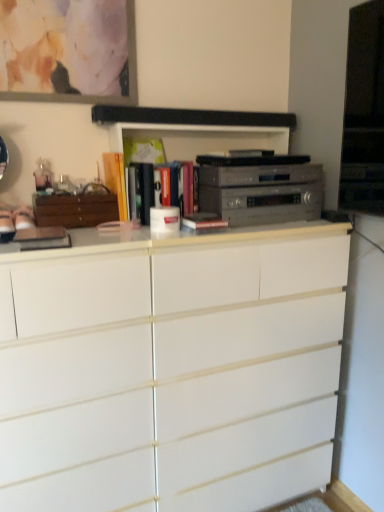
Question: Does matte orange book at center, the fourth book positioned from the right, appear on the left side of white matte chest of drawers at center?

Choices:
 (A) yes
 (B) no

Answer: (A)

Question: Is matte orange book at center, placed as the 1th book when sorted from left to right, bigger than white matte chest of drawers at center?

Choices:
 (A) no
 (B) yes

Answer: (A)

Question: Does matte orange book at center, the fourth book positioned from the right, have a greater width compared to white matte chest of drawers at center?

Choices:
 (A) yes
 (B) no

Answer: (B)

Question: Is matte orange book at center, placed as the 1th book when sorted from left to right, not inside white matte chest of drawers at center?

Choices:
 (A) yes
 (B) no

Answer: (A)

Question: Considering the relative positions of matte orange book at center, the fourth book positioned from the right, and white matte chest of drawers at center in the image provided, is matte orange book at center, the fourth book positioned from the right, to the right of white matte chest of drawers at center from the viewer's perspective?

Choices:
 (A) yes
 (B) no

Answer: (B)

Question: Can you confirm if matte orange book at center, the fourth book positioned from the right, is taller than white matte chest of drawers at center?

Choices:
 (A) no
 (B) yes

Answer: (A)

Question: From a real-world perspective, is wooden cabinet at left on matte glass picture frame at upper left?

Choices:
 (A) no
 (B) yes

Answer: (A)

Question: Is wooden cabinet at left shorter than matte glass picture frame at upper left?

Choices:
 (A) no
 (B) yes

Answer: (B)

Question: Considering the relative sizes of wooden cabinet at left and matte glass picture frame at upper left in the image provided, is wooden cabinet at left taller than matte glass picture frame at upper left?

Choices:
 (A) yes
 (B) no

Answer: (B)

Question: Are wooden cabinet at left and matte glass picture frame at upper left located far from each other?

Choices:
 (A) no
 (B) yes

Answer: (A)

Question: Considering the relative positions of wooden cabinet at left and matte glass picture frame at upper left in the image provided, is wooden cabinet at left to the right of matte glass picture frame at upper left from the viewer's perspective?

Choices:
 (A) no
 (B) yes

Answer: (B)

Question: From the image's perspective, is wooden cabinet at left under matte glass picture frame at upper left?

Choices:
 (A) no
 (B) yes

Answer: (B)

Question: Does matte glass picture frame at upper left come in front of matte yellow book at center, marked as the 2th book in a left-to-right arrangement?

Choices:
 (A) no
 (B) yes

Answer: (B)